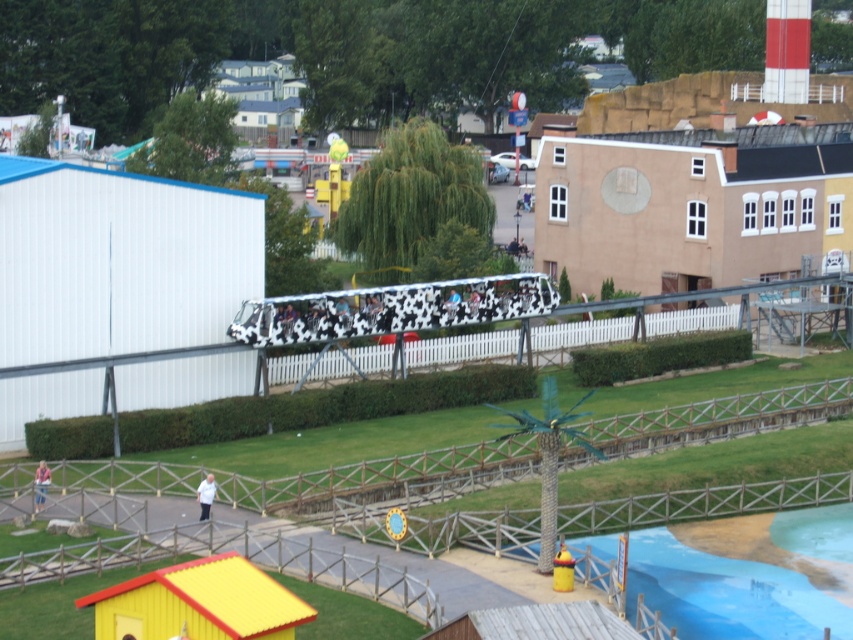
Question: Can you confirm if blue smooth pool at lower right is positioned to the left of light blue denim jeans at lower left?

Choices:
 (A) yes
 (B) no

Answer: (B)

Question: Among these objects, which one is nearest to the camera?

Choices:
 (A) white fabric shirt at lower center
 (B) light blue denim jeans at lower left
 (C) blue smooth pool at lower right

Answer: (C)

Question: Is blue smooth pool at lower right below light blue denim jeans at lower left?

Choices:
 (A) no
 (B) yes

Answer: (B)

Question: Which point is farther to the camera?

Choices:
 (A) light blue denim jeans at lower left
 (B) blue smooth pool at lower right
 (C) white fabric shirt at lower center

Answer: (A)

Question: Which object is closer to the camera taking this photo?

Choices:
 (A) blue smooth pool at lower right
 (B) white fabric shirt at lower center

Answer: (A)

Question: Is blue smooth pool at lower right positioned at the back of light blue denim jeans at lower left?

Choices:
 (A) no
 (B) yes

Answer: (A)